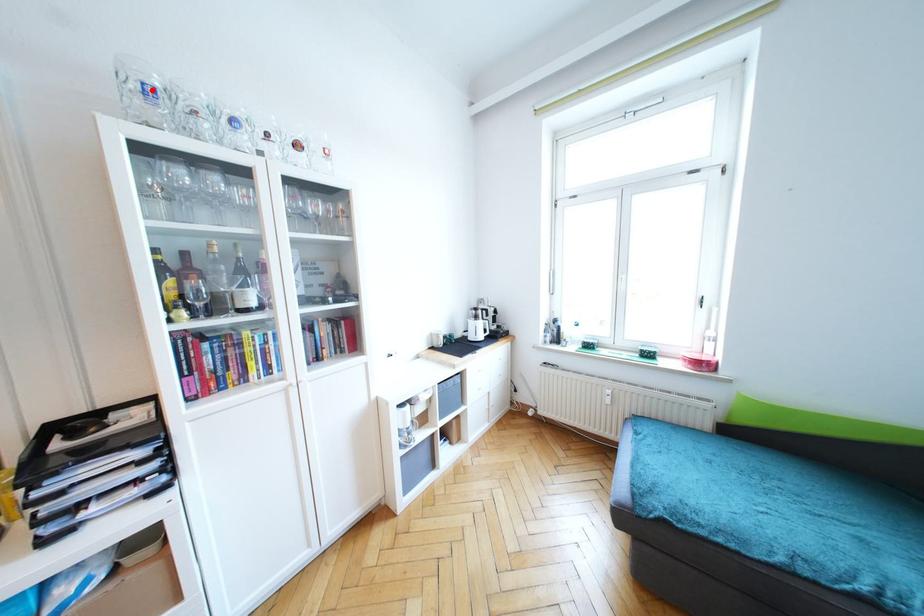
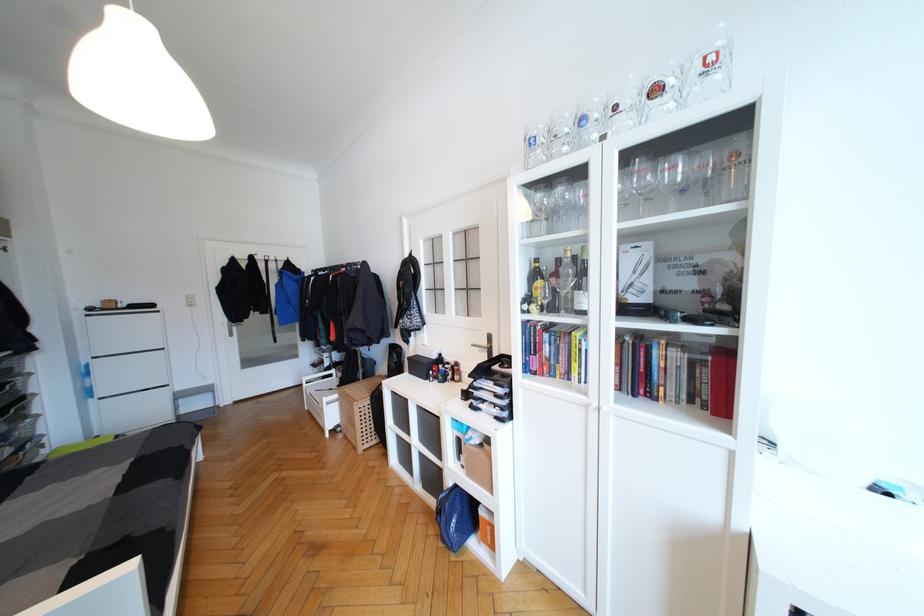
The point at the highlighted location is marked in the first image. Where is the corresponding point in the second image?

(536, 142)